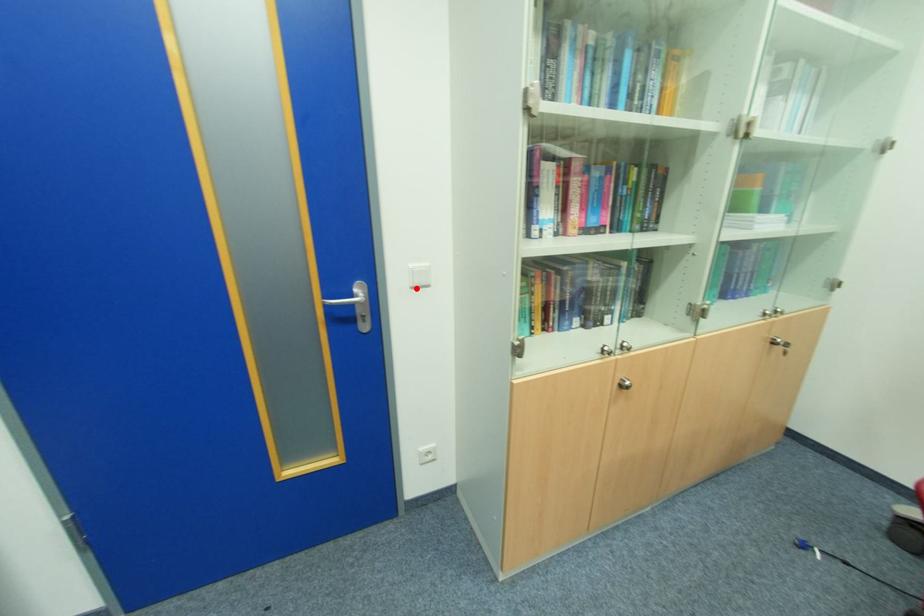
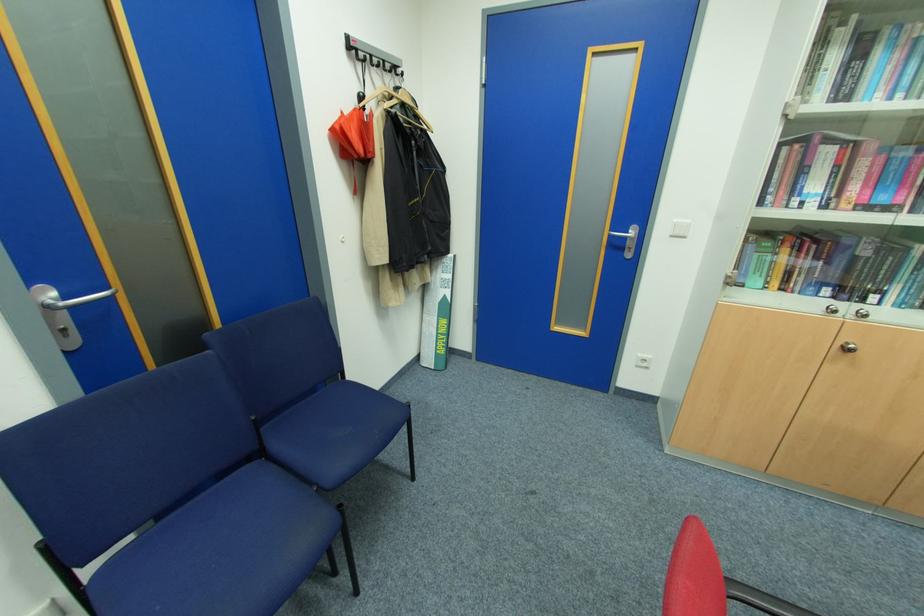
In the second image, find the point that corresponds to the highlighted location in the first image.

(675, 236)